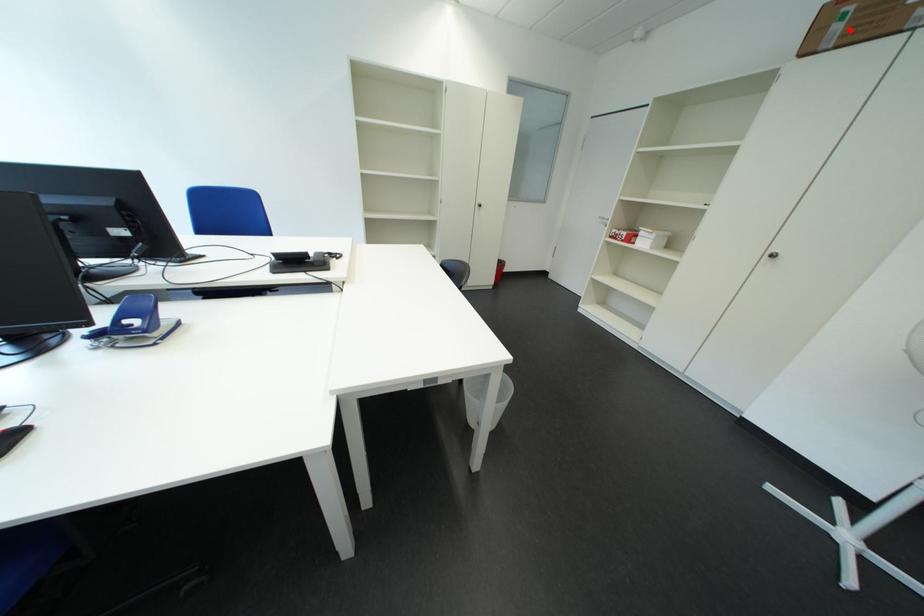
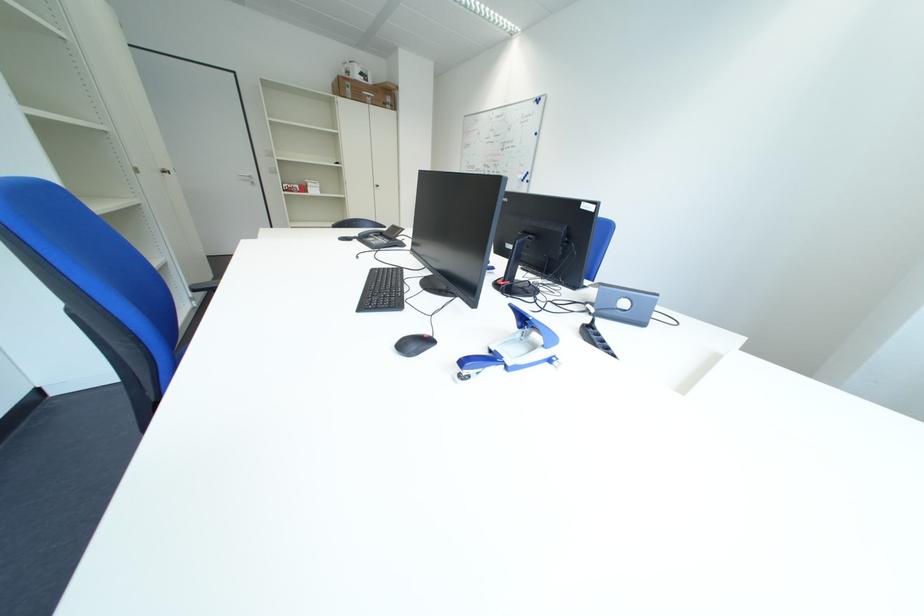
Question: I am providing you with two images of the same scene from different viewpoints. Image1 has a red point marked. In image2, the corresponding 3D location appears at what relative position? Reply with the corresponding letter.

Choices:
 (A) Closer
 (B) Farther

Answer: (A)